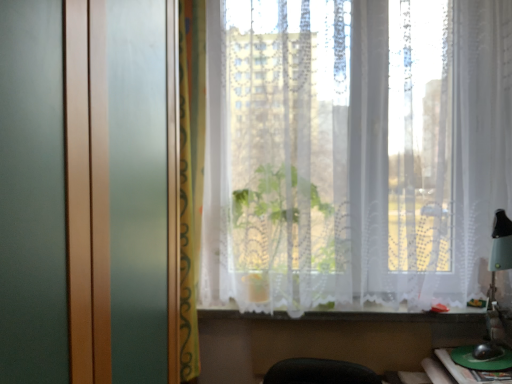
Question: Can you confirm if white lace curtain at center, the 1th curtain viewed from the right, is smaller than white lace curtain at lower center?

Choices:
 (A) yes
 (B) no

Answer: (B)

Question: Considering the relative positions of white lace curtain at center, the 1th curtain viewed from the right, and white lace curtain at lower center in the image provided, is white lace curtain at center, the 1th curtain viewed from the right, in front of white lace curtain at lower center?

Choices:
 (A) no
 (B) yes

Answer: (B)

Question: Considering the relative positions of white lace curtain at center, acting as the 2th curtain starting from the left, and white lace curtain at lower center in the image provided, is white lace curtain at center, acting as the 2th curtain starting from the left, behind white lace curtain at lower center?

Choices:
 (A) no
 (B) yes

Answer: (A)

Question: Can you confirm if white lace curtain at center, the 1th curtain viewed from the right, is positioned to the right of white lace curtain at lower center?

Choices:
 (A) yes
 (B) no

Answer: (A)

Question: Does white lace curtain at center, the 1th curtain viewed from the right, appear on the left side of white lace curtain at lower center?

Choices:
 (A) yes
 (B) no

Answer: (B)

Question: Is green plastic table at lower right inside or outside of white lace curtain at lower center?

Choices:
 (A) inside
 (B) outside

Answer: (B)

Question: From their relative heights in the image, would you say green plastic table at lower right is taller or shorter than white lace curtain at lower center?

Choices:
 (A) tall
 (B) short

Answer: (B)

Question: Is point (434, 374) closer or farther from the camera than point (403, 317)?

Choices:
 (A) farther
 (B) closer

Answer: (A)

Question: Looking at the image, does green plastic table at lower right seem bigger or smaller compared to white lace curtain at lower center?

Choices:
 (A) big
 (B) small

Answer: (B)

Question: From their relative heights in the image, would you say white lace curtain at lower center is taller or shorter than yellow fabric curtain at center, which is counted as the 1th curtain, starting from the left?

Choices:
 (A) tall
 (B) short

Answer: (B)

Question: Looking at the image, does white lace curtain at lower center seem bigger or smaller compared to yellow fabric curtain at center, which is counted as the 1th curtain, starting from the left?

Choices:
 (A) small
 (B) big

Answer: (A)

Question: In the image, is white lace curtain at lower center positioned in front of or behind yellow fabric curtain at center, placed as the 2th curtain when sorted from right to left?

Choices:
 (A) front
 (B) behind

Answer: (B)

Question: From a real-world perspective, is white lace curtain at lower center above or below yellow fabric curtain at center, placed as the 2th curtain when sorted from right to left?

Choices:
 (A) below
 (B) above

Answer: (A)

Question: Considering the positions of white lace curtain at lower center and green plastic table at lower right in the image, is white lace curtain at lower center wider or thinner than green plastic table at lower right?

Choices:
 (A) wide
 (B) thin

Answer: (B)

Question: Relative to green plastic table at lower right, is white lace curtain at lower center in front or behind?

Choices:
 (A) behind
 (B) front

Answer: (A)